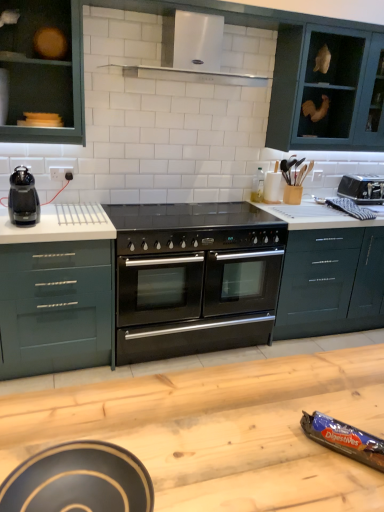
Find the location of a particular element. This screenshot has width=384, height=512. free space behind matte black bowl at lower left, the first appliance positioned from the bottom is located at coordinates (117, 418).